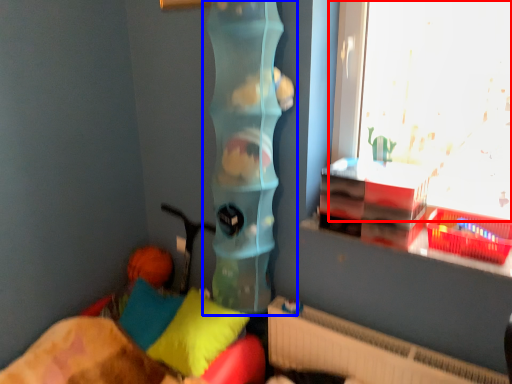
Question: Which point is closer to the camera, window (highlighted by a red box) or toy (highlighted by a blue box)?

Choices:
 (A) window
 (B) toy

Answer: (A)